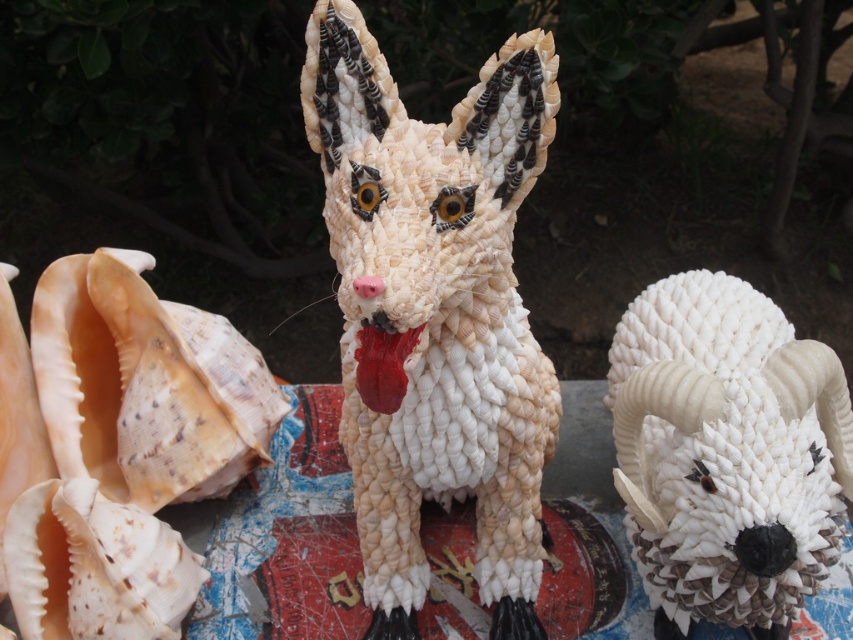
Question: Can you confirm if white shell figurine at center is positioned to the right of white rope-like goat at center?

Choices:
 (A) no
 (B) yes

Answer: (A)

Question: Which point is farther from the camera taking this photo?

Choices:
 (A) click(424, 196)
 (B) click(821, 492)
 (C) click(88, 474)

Answer: (C)

Question: Which point is closer to the camera taking this photo?

Choices:
 (A) (648, 336)
 (B) (306, 22)

Answer: (A)

Question: Among these points, which one is farthest from the camera?

Choices:
 (A) (502, 266)
 (B) (47, 406)
 (C) (679, 570)

Answer: (B)

Question: Can you confirm if white shell figurine at center is positioned to the right of white rope-like goat at center?

Choices:
 (A) yes
 (B) no

Answer: (B)

Question: Is white shell figurine at center to the left of natural seashell conch at left from the viewer's perspective?

Choices:
 (A) no
 (B) yes

Answer: (A)